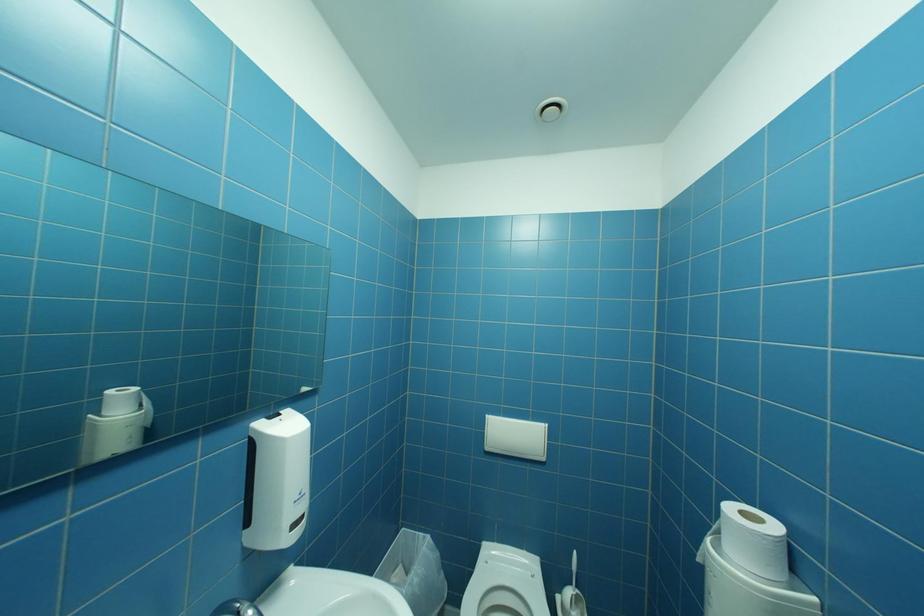
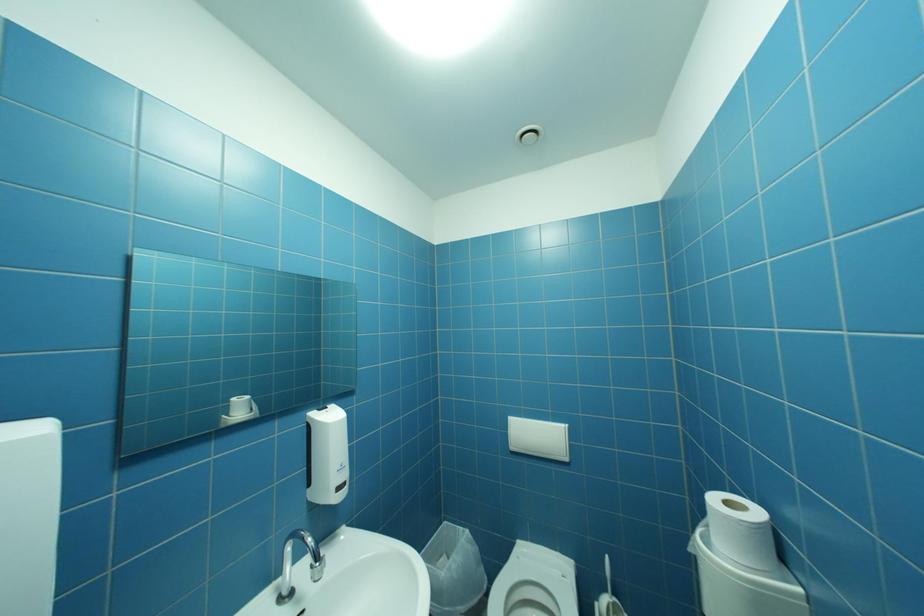
Question: The first image is from the beginning of the video and the second image is from the end. How did the camera likely rotate when shooting the video?

Choices:
 (A) Left
 (B) Right
 (C) Up
 (D) Down

Answer: (A)